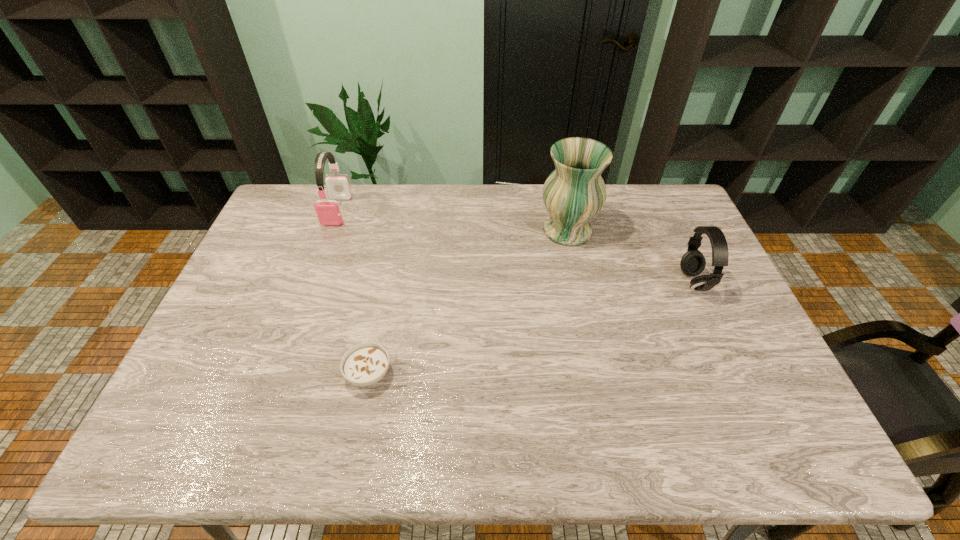
This screenshot has width=960, height=540. Find the location of `vacant space positioned 0.310m on the ear cups of the second shortest object`. vacant space positioned 0.310m on the ear cups of the second shortest object is located at coordinates (578, 282).

This screenshot has width=960, height=540. Find the location of `free space located 0.280m on the ear cups of the second shortest object`. free space located 0.280m on the ear cups of the second shortest object is located at coordinates 588,282.

The width and height of the screenshot is (960, 540). Find the location of `vacant region located 0.060m on the ear cups of the second shortest object`. vacant region located 0.060m on the ear cups of the second shortest object is located at coordinates pos(660,282).

You are a GUI agent. You are given a task and a screenshot of the screen. Output one action in this format:
    pyautogui.click(x=<x>, y=<y>)
    Task: Click on the vacant space located on the front of the shortest object
    
    Given the screenshot: What is the action you would take?
    pyautogui.click(x=352, y=457)

Find the location of a particular element. The height and width of the screenshot is (540, 960). vase that is at the far edge is located at coordinates (574, 193).

Identify the location of earphone that is at the far edge. (328, 211).

Find the location of a particular element. This screenshot has width=960, height=540. object present at the right edge is located at coordinates (693, 262).

Image resolution: width=960 pixels, height=540 pixels. Find the location of `free spot at the far edge of the desktop`. free spot at the far edge of the desktop is located at coordinates (469, 185).

This screenshot has width=960, height=540. I want to click on vacant space at the near edge of the desktop, so click(491, 456).

This screenshot has width=960, height=540. In order to click on free space at the left edge of the desktop in this screenshot , I will do `click(252, 256)`.